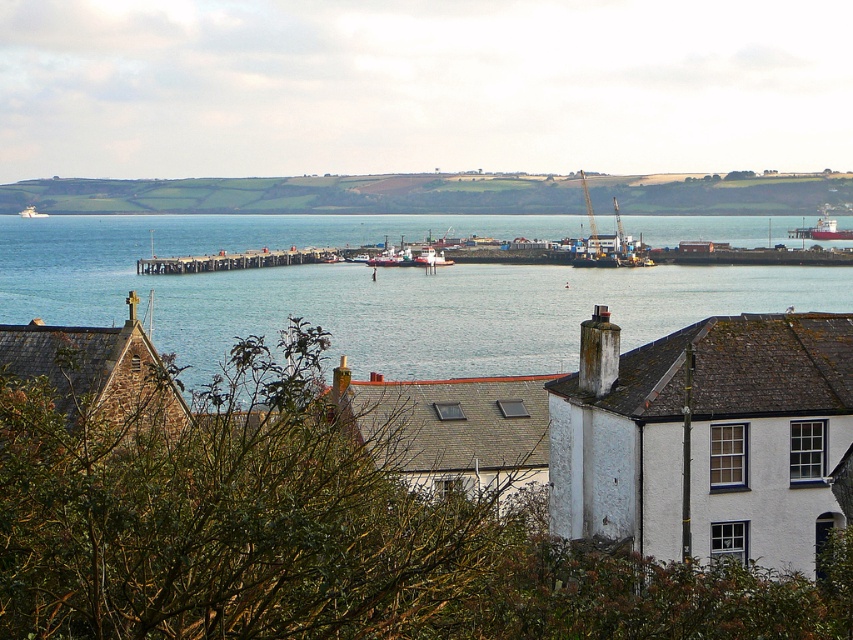
You are standing at the point marked as point (648, 435) in the image. What structure is directly beneath your feet?

The structure directly beneath your feet at point (648, 435) is the white textured building at center.

You are a drone operator trying to capture a photo of the harbor. The green grassy hillside at upper center is in your view. To ensure the harbor is fully visible, should you adjust your drone to move upwards or downwards?

The green grassy hillside at upper center is located at point (300, 195). Since the harbor is in the middle ground, adjusting the drone downwards would bring the harbor into focus while keeping the hillside in view.